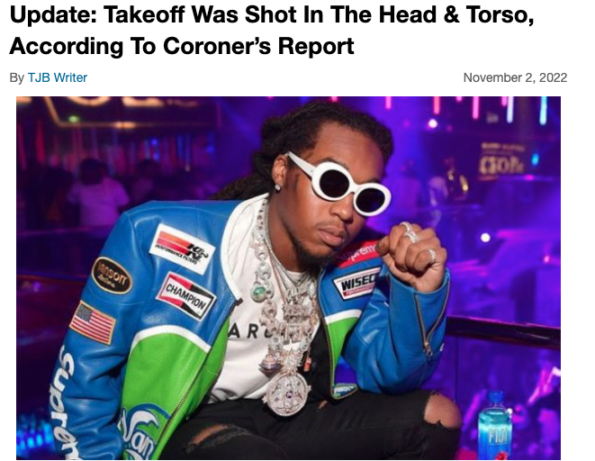
Find the location of a particular element. purple lighting is located at coordinates 416,167.